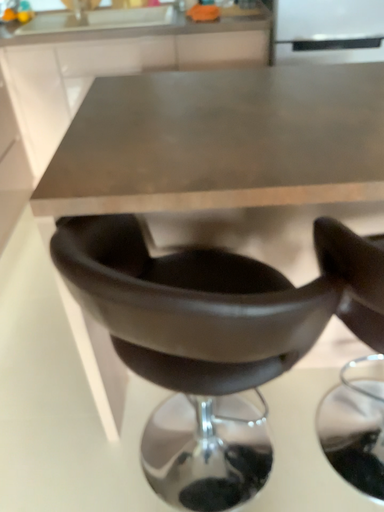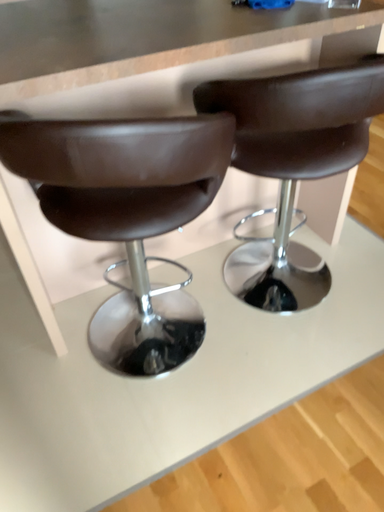
Question: How did the camera likely rotate when shooting the video?

Choices:
 (A) rotated right
 (B) rotated left

Answer: (A)